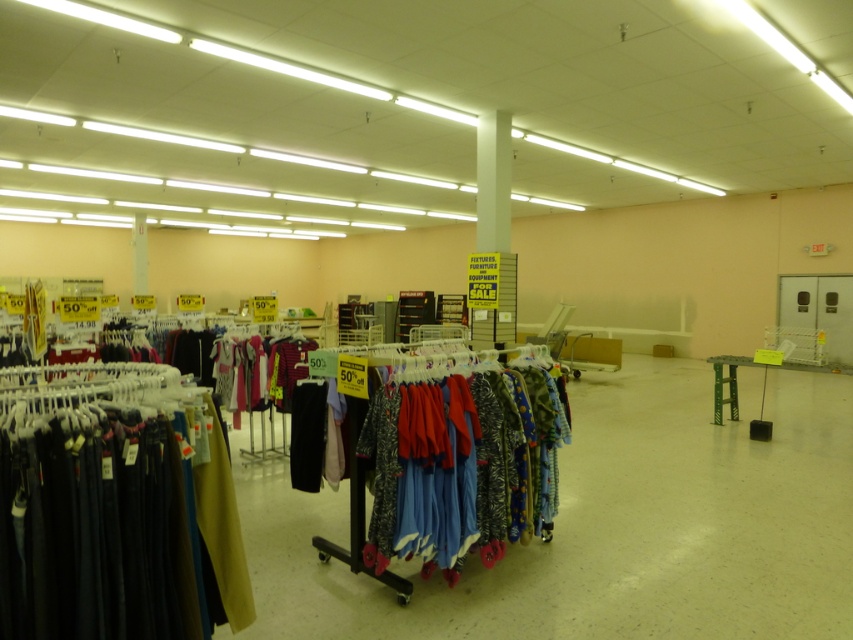
You are a customer looking to buy a pair of pants that can fit over your current size. You see the dark blue fabric pants at left and the matte cotton pajamas at center. Which one has a larger size available?

The matte cotton pajamas at center has a larger size compared to the dark blue fabric pants at left, so you should choose the matte cotton pajamas at center for a better fit.

You are a customer in the store and want to locate the dark blue fabric pants at left. According to the store layout, where should you look relative to the entrance?

The dark blue fabric pants at left are positioned at coordinates point (114, 508), so they are located near the entrance on the left side of the store.